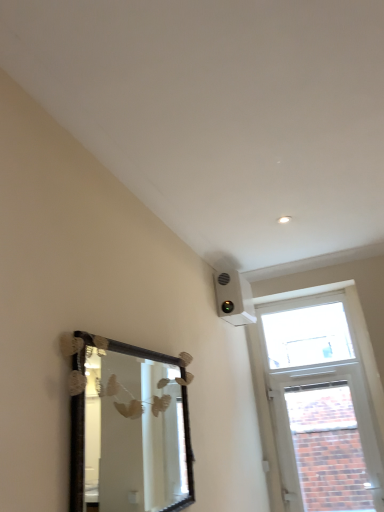
This screenshot has height=512, width=384. Find the location of `transparent glass window at upper right, the 1th window when ordered from top to bottom`. transparent glass window at upper right, the 1th window when ordered from top to bottom is located at coordinates (307, 336).

Where is `transparent glass window at upper right, the 1th window when ordered from top to bottom`? The image size is (384, 512). transparent glass window at upper right, the 1th window when ordered from top to bottom is located at coordinates (307, 336).

Find the location of `window behind the brick textured window at upper right, which is the 1th window in bottom-to-top order`. window behind the brick textured window at upper right, which is the 1th window in bottom-to-top order is located at coordinates (307, 336).

Is there a large distance between transparent glass window at upper right, the 1th window when ordered from top to bottom, and brick textured window at upper right, which ranks as the 2th window in top-to-bottom order?

No, transparent glass window at upper right, the 1th window when ordered from top to bottom, is not far from brick textured window at upper right, which ranks as the 2th window in top-to-bottom order.

Does transparent glass window at upper right, which is the second window in bottom-to-top order, have a smaller size compared to brick textured window at upper right, which ranks as the 2th window in top-to-bottom order?

Correct, transparent glass window at upper right, which is the second window in bottom-to-top order, occupies less space than brick textured window at upper right, which ranks as the 2th window in top-to-bottom order.

Is transparent glass window at upper right, which is the second window in bottom-to-top order, positioned with its back to wooden-framed mirror at lower left?

transparent glass window at upper right, which is the second window in bottom-to-top order, does not have its back to wooden-framed mirror at lower left.

Is transparent glass window at upper right, which is the second window in bottom-to-top order, wider or thinner than wooden-framed mirror at lower left?

Considering their sizes, transparent glass window at upper right, which is the second window in bottom-to-top order, looks broader than wooden-framed mirror at lower left.

From the image's perspective, does transparent glass window at upper right, the 1th window when ordered from top to bottom, appear lower than wooden-framed mirror at lower left?

Incorrect, from the image's perspective, transparent glass window at upper right, the 1th window when ordered from top to bottom, is higher than wooden-framed mirror at lower left.

Is transparent glass window at upper right, which is the second window in bottom-to-top order, directly adjacent to wooden-framed mirror at lower left?

No, transparent glass window at upper right, which is the second window in bottom-to-top order, is not beside wooden-framed mirror at lower left.

In the scene shown: Can you confirm if brick textured window at upper right, which ranks as the 2th window in top-to-bottom order, is bigger than wooden-framed mirror at lower left?

Yes.

Between brick textured window at upper right, which ranks as the 2th window in top-to-bottom order, and wooden-framed mirror at lower left, which one appears on the right side from the viewer's perspective?

Positioned to the right is brick textured window at upper right, which ranks as the 2th window in top-to-bottom order.

From a real-world perspective, does brick textured window at upper right, which ranks as the 2th window in top-to-bottom order, stand above wooden-framed mirror at lower left?

No.

Considering the sizes of objects brick textured window at upper right, which is the 1th window in bottom-to-top order, and transparent glass window at upper right, the 1th window when ordered from top to bottom, in the image provided, who is shorter, brick textured window at upper right, which is the 1th window in bottom-to-top order, or transparent glass window at upper right, the 1th window when ordered from top to bottom,?

transparent glass window at upper right, the 1th window when ordered from top to bottom.

Can you confirm if brick textured window at upper right, which is the 1th window in bottom-to-top order, is bigger than transparent glass window at upper right, which is the second window in bottom-to-top order?

Yes.

Is brick textured window at upper right, which is the 1th window in bottom-to-top order, inside or outside of transparent glass window at upper right, which is the second window in bottom-to-top order?

The correct answer is: outside.

Is brick textured window at upper right, which ranks as the 2th window in top-to-bottom order, next to transparent glass window at upper right, the 1th window when ordered from top to bottom?

No, brick textured window at upper right, which ranks as the 2th window in top-to-bottom order, is not next to transparent glass window at upper right, the 1th window when ordered from top to bottom.

Based on the photo, from a real-world perspective, is wooden-framed mirror at lower left positioned under brick textured window at upper right, which ranks as the 2th window in top-to-bottom order, based on gravity?

Incorrect, from a real-world perspective, wooden-framed mirror at lower left is higher than brick textured window at upper right, which ranks as the 2th window in top-to-bottom order.

Is wooden-framed mirror at lower left spatially inside brick textured window at upper right, which ranks as the 2th window in top-to-bottom order, or outside of it?

wooden-framed mirror at lower left lies outside brick textured window at upper right, which ranks as the 2th window in top-to-bottom order.

From the picture: Between wooden-framed mirror at lower left and brick textured window at upper right, which ranks as the 2th window in top-to-bottom order, which one has more height?

brick textured window at upper right, which ranks as the 2th window in top-to-bottom order, is taller.

Is wooden-framed mirror at lower left looking in the opposite direction of brick textured window at upper right, which is the 1th window in bottom-to-top order?

No, brick textured window at upper right, which is the 1th window in bottom-to-top order, is not at the back of wooden-framed mirror at lower left.

How much distance is there between wooden-framed mirror at lower left and transparent glass window at upper right, which is the second window in bottom-to-top order?

wooden-framed mirror at lower left is 4.86 feet away from transparent glass window at upper right, which is the second window in bottom-to-top order.

Considering the relative positions of wooden-framed mirror at lower left and transparent glass window at upper right, which is the second window in bottom-to-top order, in the image provided, is wooden-framed mirror at lower left behind transparent glass window at upper right, which is the second window in bottom-to-top order,?

No, wooden-framed mirror at lower left is closer to the camera.

Is wooden-framed mirror at lower left to the left or to the right of transparent glass window at upper right, which is the second window in bottom-to-top order, in the image?

In the image, wooden-framed mirror at lower left appears on the left side of transparent glass window at upper right, which is the second window in bottom-to-top order.

Can you confirm if wooden-framed mirror at lower left is shorter than transparent glass window at upper right, which is the second window in bottom-to-top order?

No.

Locate an element on the screen. window positioned vertically above the brick textured window at upper right, which ranks as the 2th window in top-to-bottom order (from a real-world perspective) is located at coordinates (307, 336).

The height and width of the screenshot is (512, 384). Find the location of `mirror on the left of the transparent glass window at upper right, the 1th window when ordered from top to bottom`. mirror on the left of the transparent glass window at upper right, the 1th window when ordered from top to bottom is located at coordinates (134, 434).

Which object lies nearer to the anchor point transparent glass window at upper right, which is the second window in bottom-to-top order, wooden-framed mirror at lower left or brick textured window at upper right, which ranks as the 2th window in top-to-bottom order?

brick textured window at upper right, which ranks as the 2th window in top-to-bottom order, is closer to transparent glass window at upper right, which is the second window in bottom-to-top order.

Looking at this image, based on their spatial positions, is brick textured window at upper right, which is the 1th window in bottom-to-top order, or transparent glass window at upper right, the 1th window when ordered from top to bottom, further from wooden-framed mirror at lower left?

Among the two, transparent glass window at upper right, the 1th window when ordered from top to bottom, is located further to wooden-framed mirror at lower left.

From the image, which object appears to be farther from brick textured window at upper right, which is the 1th window in bottom-to-top order, wooden-framed mirror at lower left or transparent glass window at upper right, the 1th window when ordered from top to bottom?

wooden-framed mirror at lower left lies further to brick textured window at upper right, which is the 1th window in bottom-to-top order, than the other object.

Estimate the real-world distances between objects in this image. Which object is closer to brick textured window at upper right, which is the 1th window in bottom-to-top order, transparent glass window at upper right, the 1th window when ordered from top to bottom, or wooden-framed mirror at lower left?

transparent glass window at upper right, the 1th window when ordered from top to bottom, is positioned closer to the anchor brick textured window at upper right, which is the 1th window in bottom-to-top order.

When comparing their distances from transparent glass window at upper right, which is the second window in bottom-to-top order, does brick textured window at upper right, which ranks as the 2th window in top-to-bottom order, or wooden-framed mirror at lower left seem further?

Based on the image, wooden-framed mirror at lower left appears to be further to transparent glass window at upper right, which is the second window in bottom-to-top order.

When comparing their distances from wooden-framed mirror at lower left, does transparent glass window at upper right, which is the second window in bottom-to-top order, or brick textured window at upper right, which is the 1th window in bottom-to-top order, seem closer?

brick textured window at upper right, which is the 1th window in bottom-to-top order, is closer to wooden-framed mirror at lower left.

The height and width of the screenshot is (512, 384). Find the location of `window positioned between wooden-framed mirror at lower left and transparent glass window at upper right, the 1th window when ordered from top to bottom, from near to far`. window positioned between wooden-framed mirror at lower left and transparent glass window at upper right, the 1th window when ordered from top to bottom, from near to far is located at coordinates (328, 448).